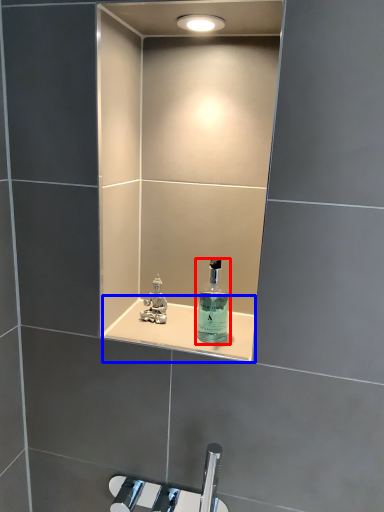
Question: Which of the following is the closest to the observer, bottle (highlighted by a red box) or shelve (highlighted by a blue box)?

Choices:
 (A) bottle
 (B) shelve

Answer: (A)